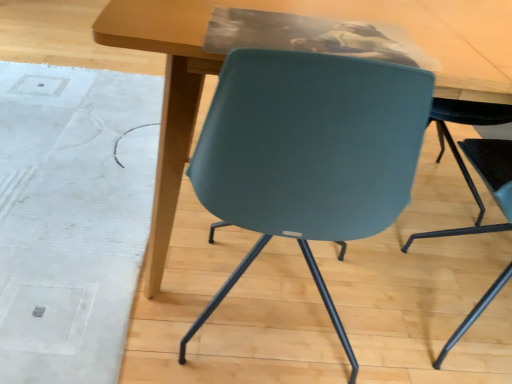
Question: Is white textured mat at lower left at the left side of teal plastic chair at lower right?

Choices:
 (A) no
 (B) yes

Answer: (B)

Question: Is white textured mat at lower left next to teal plastic chair at lower right and touching it?

Choices:
 (A) no
 (B) yes

Answer: (A)

Question: Can you confirm if white textured mat at lower left is shorter than teal plastic chair at lower right?

Choices:
 (A) no
 (B) yes

Answer: (B)

Question: Is white textured mat at lower left taller than teal plastic chair at lower right?

Choices:
 (A) no
 (B) yes

Answer: (A)

Question: Is white textured mat at lower left oriented towards teal plastic chair at lower right?

Choices:
 (A) yes
 (B) no

Answer: (B)

Question: Is teal plastic chair at lower right at the back of white textured mat at lower left?

Choices:
 (A) yes
 (B) no

Answer: (B)

Question: Is white textured mat at lower left aimed at matte wood table at center?

Choices:
 (A) yes
 (B) no

Answer: (A)

Question: Does white textured mat at lower left have a greater width compared to matte wood table at center?

Choices:
 (A) no
 (B) yes

Answer: (B)

Question: Is white textured mat at lower left next to matte wood table at center?

Choices:
 (A) no
 (B) yes

Answer: (A)

Question: Does white textured mat at lower left have a lesser width compared to matte wood table at center?

Choices:
 (A) no
 (B) yes

Answer: (A)

Question: Is white textured mat at lower left outside matte wood table at center?

Choices:
 (A) no
 (B) yes

Answer: (B)

Question: Could matte wood table at center be considered to be inside white textured mat at lower left?

Choices:
 (A) no
 (B) yes

Answer: (A)

Question: Is matte wood table at center closer to the viewer compared to white textured mat at lower left?

Choices:
 (A) no
 (B) yes

Answer: (B)